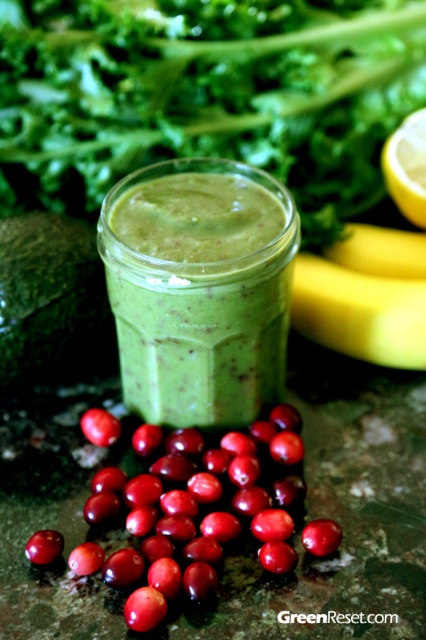
You are trying to determine which fruit is wider between the shiny red berry at lower left and the shiny red cherry at lower left. Can you tell me which one is wider?

The shiny red berry at lower left might be wider than shiny red cherry at lower left according to the description.

You are a person with a height of 160 cm standing in front of the green matte smoothie at center. If you want to take a sip from the smoothie, will you be able to reach it without moving your feet?

The green matte smoothie at center is 80.61 centimeters away from the viewer. Since the average arm length for a person of 160 cm is approximately 66 cm, you may need to lean forward slightly to reach it, but it is within a reachable distance.

You are a food photographer setting up a shot of the green matte smoothie at center and the yellow smooth skin banana at right. Which object should you adjust to ensure both are in focus? Explain your reasoning based on their positions.

The yellow smooth skin banana at right should be moved closer to the viewer to align with the green matte smoothie at center, as the green matte smoothie at center is currently closer to the viewer. This adjustment will ensure both are at the same focal plane.